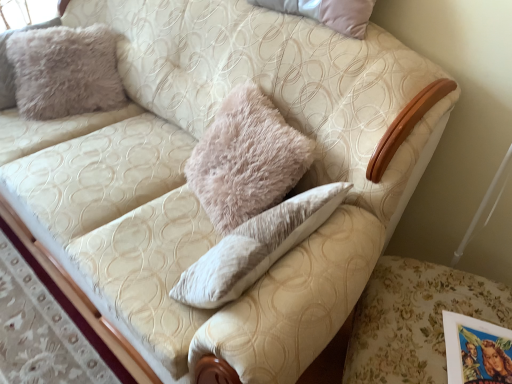
Question: Should I look upward or downward to see fuzzy beige pillow at upper left?

Choices:
 (A) down
 (B) up

Answer: (B)

Question: Is fuzzy beige pillow at upper left located within floral fabric swivel chair at lower right?

Choices:
 (A) yes
 (B) no

Answer: (B)

Question: Is floral fabric swivel chair at lower right beside fuzzy beige pillow at upper left?

Choices:
 (A) yes
 (B) no

Answer: (B)

Question: Considering the relative sizes of floral fabric swivel chair at lower right and fuzzy beige pillow at upper left in the image provided, is floral fabric swivel chair at lower right thinner than fuzzy beige pillow at upper left?

Choices:
 (A) yes
 (B) no

Answer: (B)

Question: From the image's perspective, is floral fabric swivel chair at lower right on fuzzy beige pillow at upper left?

Choices:
 (A) no
 (B) yes

Answer: (A)

Question: From a real-world perspective, is floral fabric swivel chair at lower right physically below fuzzy beige pillow at upper left?

Choices:
 (A) no
 (B) yes

Answer: (B)

Question: Can you confirm if floral fabric swivel chair at lower right is taller than fuzzy beige pillow at upper left?

Choices:
 (A) no
 (B) yes

Answer: (A)

Question: Can you confirm if fuzzy beige pillow at upper left is bigger than floral fabric swivel chair at lower right?

Choices:
 (A) yes
 (B) no

Answer: (B)

Question: From a real-world perspective, is fuzzy beige pillow at upper left on top of floral fabric swivel chair at lower right?

Choices:
 (A) no
 (B) yes

Answer: (B)

Question: Considering the relative positions of fuzzy beige pillow at upper left and floral fabric swivel chair at lower right in the image provided, is fuzzy beige pillow at upper left to the right of floral fabric swivel chair at lower right from the viewer's perspective?

Choices:
 (A) yes
 (B) no

Answer: (B)

Question: Is fuzzy beige pillow at upper left outside of floral fabric swivel chair at lower right?

Choices:
 (A) no
 (B) yes

Answer: (B)

Question: Are fuzzy beige pillow at upper left and floral fabric swivel chair at lower right beside each other?

Choices:
 (A) no
 (B) yes

Answer: (A)

Question: From the image's perspective, would you say fuzzy beige pillow at upper left is positioned over floral fabric swivel chair at lower right?

Choices:
 (A) yes
 (B) no

Answer: (A)

Question: From the image's perspective, relative to floral fabric swivel chair at lower right, is fuzzy beige pillow at upper left above or below?

Choices:
 (A) above
 (B) below

Answer: (A)